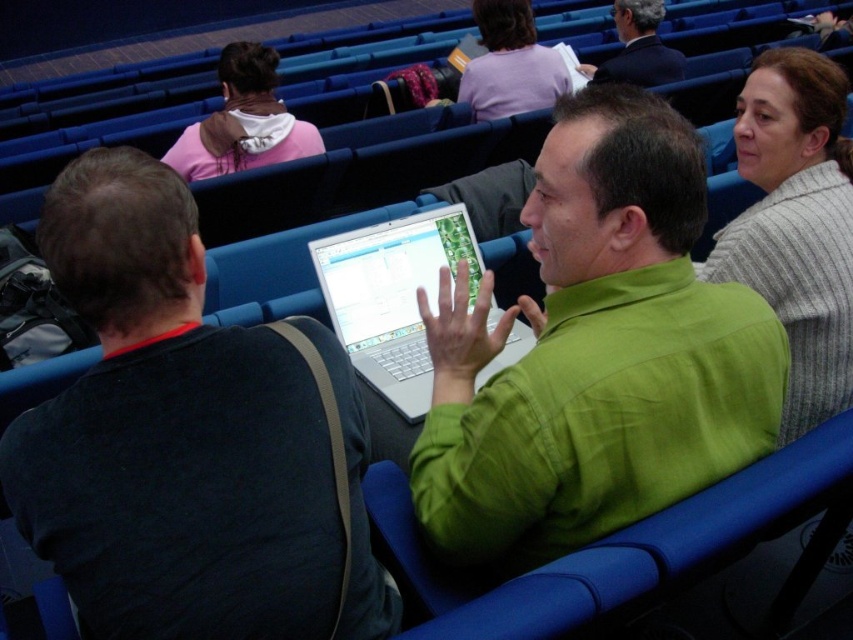
Based on the photo, can you confirm if silver metallic laptop at center is bigger than dark gray suit at upper right?

Actually, silver metallic laptop at center might be smaller than dark gray suit at upper right.

Is silver metallic laptop at center further to the viewer compared to dark gray suit at upper right?

No, silver metallic laptop at center is closer to the viewer.

Does point (412, 321) come closer to viewer compared to point (641, 84)?

Yes, it is in front of point (641, 84).

In order to click on silver metallic laptop at center in this screenshot , I will do `click(393, 296)`.

Based on the photo, is gray striped sweater at upper right positioned at the back of pink fleece jacket at upper left?

No, gray striped sweater at upper right is closer to the viewer.

Who is more forward, (802, 348) or (280, 109)?

Point (802, 348)

I want to click on gray striped sweater at upper right, so click(796, 225).

Can you confirm if pink fleece jacket at upper left is positioned below dark gray suit at upper right?

Yes, pink fleece jacket at upper left is below dark gray suit at upper right.

Who is more distant from viewer, (x=247, y=113) or (x=674, y=51)?

Point (x=674, y=51)

At what (x,y) coordinates should I click in order to perform the action: click on pink fleece jacket at upper left. Please return your answer as a coordinate pair (x, y). This screenshot has width=853, height=640. Looking at the image, I should click on (242, 120).